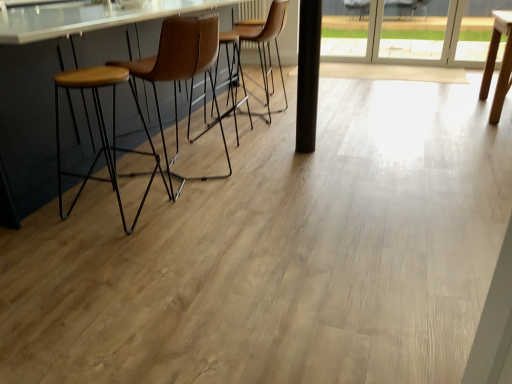
Where is `vacant space in front of transparent glass door at upper right, which is counted as the 1th window, starting from the left`? Image resolution: width=512 pixels, height=384 pixels. vacant space in front of transparent glass door at upper right, which is counted as the 1th window, starting from the left is located at coordinates (351, 60).